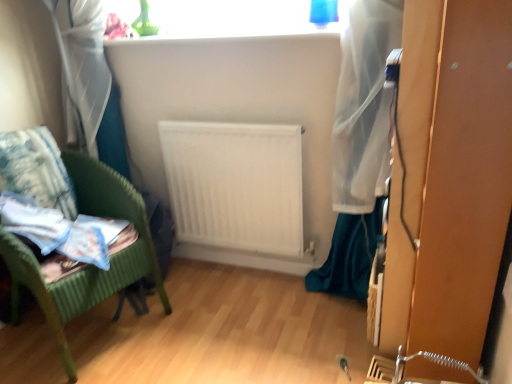
In order to face white matte radiator at center, should I rotate leftwards or rightwards?

To align with it, rotate left about 2.667°.

You are a GUI agent. You are given a task and a screenshot of the screen. Output one action in this format:
    pyautogui.click(x=<x>, y=<y>)
    Task: Click on the green wicker chair at left
    The height and width of the screenshot is (384, 512).
    Given the screenshot: What is the action you would take?
    pyautogui.click(x=73, y=219)

Is point (8, 152) closer to camera compared to point (281, 217)?

Yes.

Can you tell me how much fluffy white pillow at left and white matte radiator at center differ in facing direction?

66.8 degrees separate the facing orientations of fluffy white pillow at left and white matte radiator at center.

Which object is wider, fluffy white pillow at left or white matte radiator at center?

fluffy white pillow at left is wider.

Would you consider fluffy white pillow at left to be distant from white matte radiator at center?

No.

Would you say white matte radiator at center is to the left or to the right of green wicker chair at left in the picture?

Based on their positions, white matte radiator at center is located to the right of green wicker chair at left.

Identify the location of radiator behind the green wicker chair at left. [x=234, y=184].

Would you consider white matte radiator at center to be distant from green wicker chair at left?

That's not correct — white matte radiator at center is a little close to green wicker chair at left.

How much distance is there between white matte radiator at center and green wicker chair at left?

A distance of 45.52 centimeters exists between white matte radiator at center and green wicker chair at left.

Who is taller, white matte radiator at center or fluffy white pillow at left?

With more height is white matte radiator at center.

Would you say white matte radiator at center is outside fluffy white pillow at left?

Yes, white matte radiator at center is not within fluffy white pillow at left.

From the image's perspective, which is above, white matte radiator at center or fluffy white pillow at left?

fluffy white pillow at left appears higher in the image.

What's the angular difference between white matte radiator at center and fluffy white pillow at left's facing directions?

66.8 degrees.

Which is in front, point (39, 135) or point (80, 164)?

The point (39, 135) is in front.

Is fluffy white pillow at left closer to the viewer compared to green wicker chair at left?

No, it is not.

Does fluffy white pillow at left appear on the left side of green wicker chair at left?

Yes.

Can you confirm if green wicker chair at left is thinner than fluffy white pillow at left?

No.

Is green wicker chair at left not close to fluffy white pillow at left?

Actually, green wicker chair at left and fluffy white pillow at left are a little close together.

Is green wicker chair at left bigger than fluffy white pillow at left?

Indeed, green wicker chair at left has a larger size compared to fluffy white pillow at left.

Is green wicker chair at left shorter than fluffy white pillow at left?

Incorrect, the height of green wicker chair at left does not fall short of that of fluffy white pillow at left.

Does green wicker chair at left have a smaller size compared to white matte radiator at center?

Incorrect, green wicker chair at left is not smaller in size than white matte radiator at center.

The height and width of the screenshot is (384, 512). In the image, there is a white matte radiator at center. Find the location of `furniture below it (from the image's perspective)`. furniture below it (from the image's perspective) is located at coordinates (73, 219).

From the image's perspective, which one is positioned lower, green wicker chair at left or white matte radiator at center?

green wicker chair at left appears lower in the image.

Is green wicker chair at left situated inside white matte radiator at center or outside?

green wicker chair at left is located beyond the bounds of white matte radiator at center.

What are the coordinates of `radiator lying on the right of fluffy white pillow at left` in the screenshot? It's located at coord(234,184).

Find the location of a particular element. This screenshot has height=384, width=512. radiator above the green wicker chair at left (from the image's perspective) is located at coordinates (234, 184).

Looking at this image, based on their spatial positions, is fluffy white pillow at left or green wicker chair at left closer to white matte radiator at center?

The object closer to white matte radiator at center is green wicker chair at left.

When comparing their distances from fluffy white pillow at left, does white matte radiator at center or green wicker chair at left seem further?

white matte radiator at center.

When comparing their distances from green wicker chair at left, does fluffy white pillow at left or white matte radiator at center seem further?

white matte radiator at center lies further to green wicker chair at left than the other object.

Considering their positions, is green wicker chair at left positioned further to white matte radiator at center than fluffy white pillow at left?

fluffy white pillow at left.

Estimate the real-world distances between objects in this image. Which object is closer to green wicker chair at left, white matte radiator at center or fluffy white pillow at left?

fluffy white pillow at left lies closer to green wicker chair at left than the other object.

When comparing their distances from fluffy white pillow at left, does green wicker chair at left or white matte radiator at center seem closer?

The object closer to fluffy white pillow at left is green wicker chair at left.

Find the location of a particular element. The height and width of the screenshot is (384, 512). furniture between fluffy white pillow at left and white matte radiator at center in the horizontal direction is located at coordinates (73, 219).